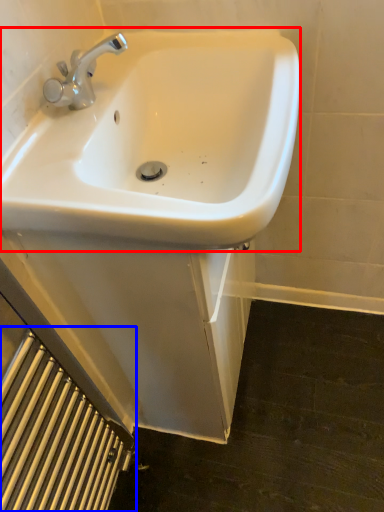
Question: Which object appears farthest to the camera in this image, sink (highlighted by a red box) or radiator (highlighted by a blue box)?

Choices:
 (A) sink
 (B) radiator

Answer: (A)